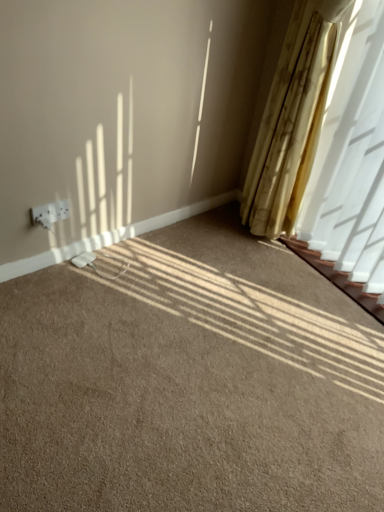
Question: Considering the relative positions of yellow textured curtain at right and brown carpet at center in the image provided, is yellow textured curtain at right behind brown carpet at center?

Choices:
 (A) yes
 (B) no

Answer: (A)

Question: Considering the relative sizes of yellow textured curtain at right and brown carpet at center in the image provided, is yellow textured curtain at right taller than brown carpet at center?

Choices:
 (A) yes
 (B) no

Answer: (A)

Question: Is yellow textured curtain at right positioned beyond the bounds of brown carpet at center?

Choices:
 (A) no
 (B) yes

Answer: (B)

Question: Considering the relative sizes of yellow textured curtain at right and brown carpet at center in the image provided, is yellow textured curtain at right shorter than brown carpet at center?

Choices:
 (A) yes
 (B) no

Answer: (B)

Question: Considering the relative sizes of yellow textured curtain at right and brown carpet at center in the image provided, is yellow textured curtain at right thinner than brown carpet at center?

Choices:
 (A) no
 (B) yes

Answer: (B)

Question: From their relative heights in the image, would you say white plastic outlet at lower left is taller or shorter than yellow textured curtain at right?

Choices:
 (A) short
 (B) tall

Answer: (A)

Question: From the image's perspective, is white plastic outlet at lower left above or below yellow textured curtain at right?

Choices:
 (A) below
 (B) above

Answer: (A)

Question: From a real-world perspective, is white plastic outlet at lower left above or below yellow textured curtain at right?

Choices:
 (A) below
 (B) above

Answer: (A)

Question: In terms of width, does white plastic outlet at lower left look wider or thinner when compared to yellow textured curtain at right?

Choices:
 (A) wide
 (B) thin

Answer: (B)

Question: Is point (322, 215) positioned closer to the camera than point (62, 200)?

Choices:
 (A) closer
 (B) farther

Answer: (B)

Question: Would you say yellow textured curtain at right is inside or outside white plastic outlet at lower left?

Choices:
 (A) outside
 (B) inside

Answer: (A)

Question: From a real-world perspective, is yellow textured curtain at right positioned above or below white plastic outlet at lower left?

Choices:
 (A) below
 (B) above

Answer: (B)

Question: In terms of size, does yellow textured curtain at right appear bigger or smaller than white plastic outlet at lower left?

Choices:
 (A) small
 (B) big

Answer: (B)

Question: From the image's perspective, is brown carpet at center above or below yellow textured curtain at right?

Choices:
 (A) above
 (B) below

Answer: (B)

Question: From a real-world perspective, is brown carpet at center physically located above or below yellow textured curtain at right?

Choices:
 (A) above
 (B) below

Answer: (B)